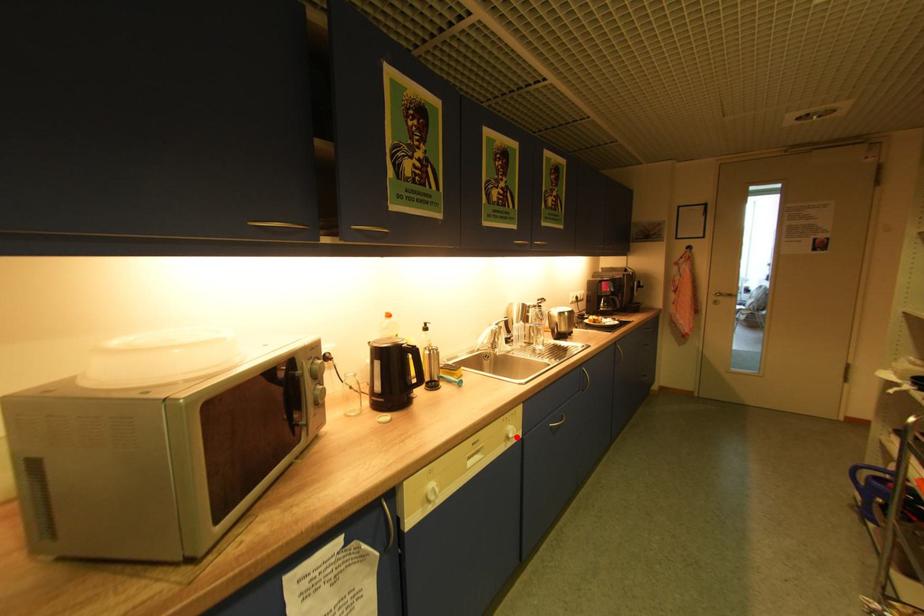
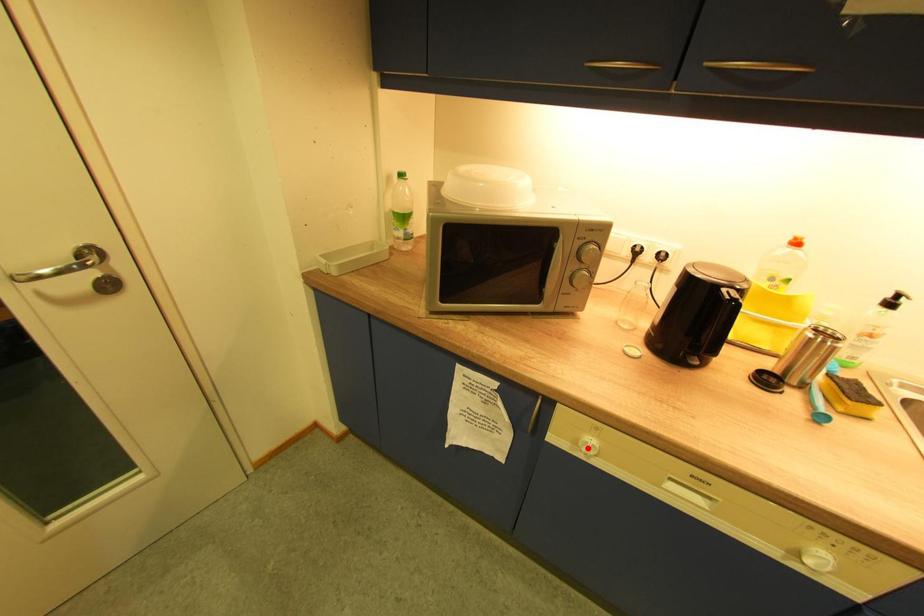
I am providing you with two images of the same scene from different viewpoints. A red point is marked on the first image and another point is marked on the second image. Does the point marked in image1 correspond to the same location as the one in image2?

No